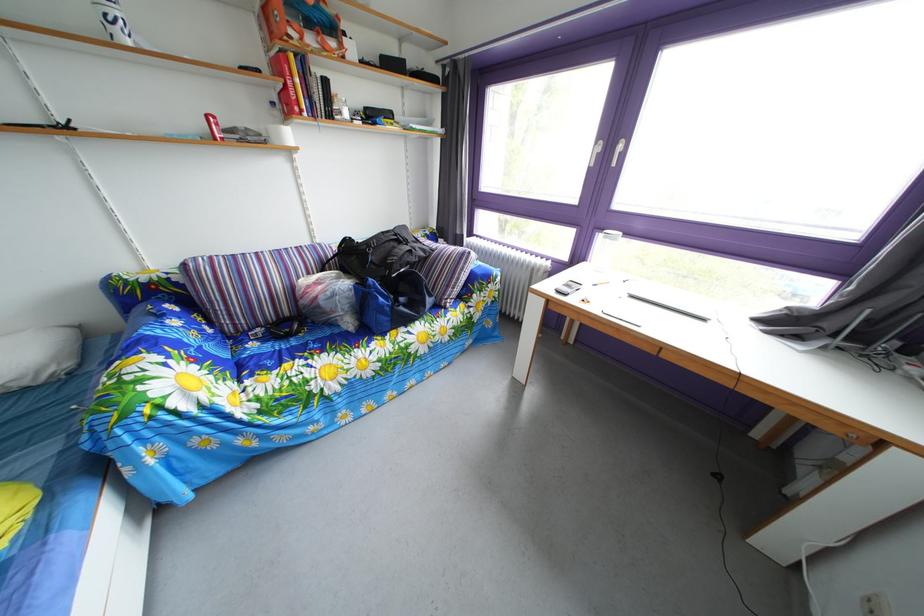
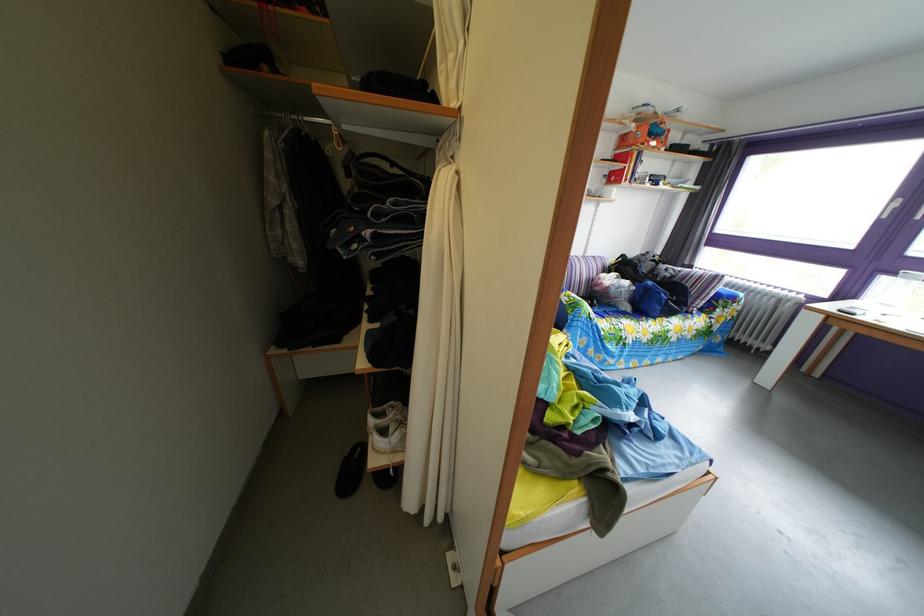
Locate, in the second image, the point that corresponds to (x=359, y=331) in the first image.

(638, 315)